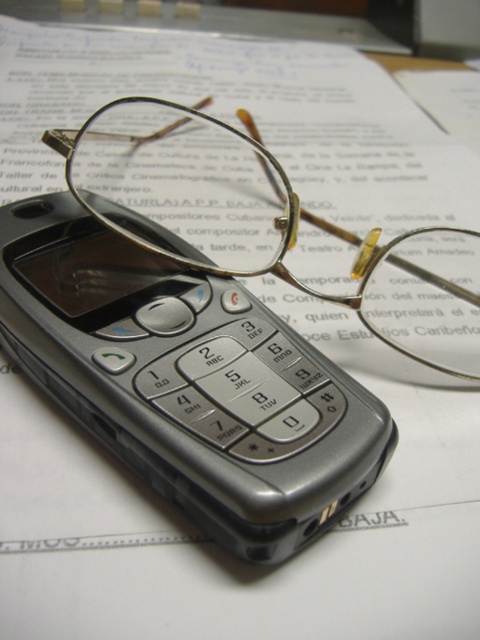
Question: Can you confirm if silver metallic phone at center is positioned above gold metallic glasses at center?

Choices:
 (A) yes
 (B) no

Answer: (B)

Question: Does silver metallic phone at center have a smaller size compared to gold metallic glasses at center?

Choices:
 (A) no
 (B) yes

Answer: (B)

Question: Among these points, which one is nearest to the camera?

Choices:
 (A) (25, 198)
 (B) (299, 202)

Answer: (B)

Question: Among these objects, which one is nearest to the camera?

Choices:
 (A) silver metallic phone at center
 (B) gold metallic glasses at center

Answer: (A)

Question: Which point appears closest to the camera in this image?

Choices:
 (A) (223, 144)
 (B) (85, 262)

Answer: (B)

Question: Can you confirm if silver metallic phone at center is thinner than gold metallic glasses at center?

Choices:
 (A) no
 (B) yes

Answer: (B)